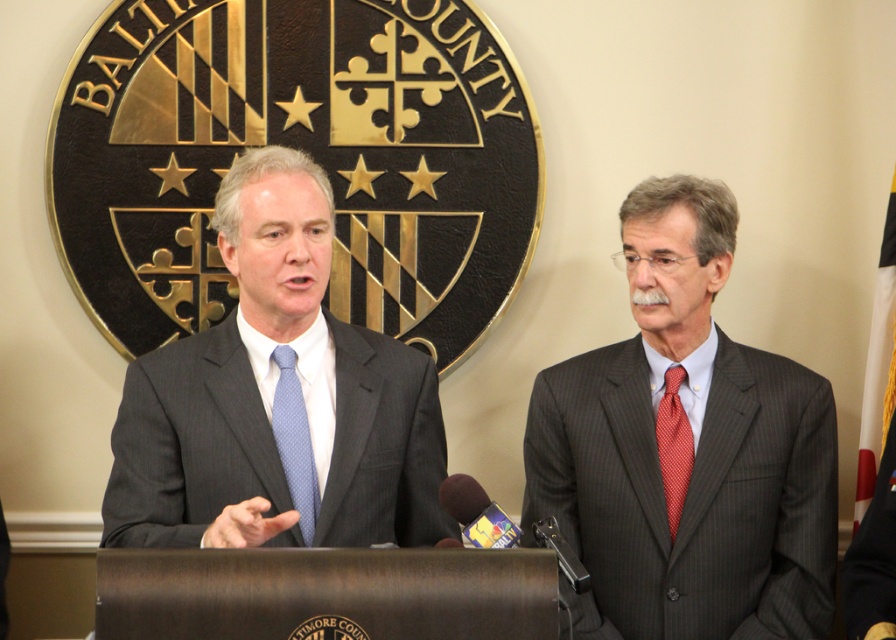
You are a photographer setting up for a group photo. You need to position two subjects wearing the dark gray pinstripe suit at right and the matte gray suit at center. Given the current distance between them, can you fit a 30 inch wide equipment cart between them without moving either subject?

The dark gray pinstripe suit at right is 29.54 inches away from the matte gray suit at center. Since the equipment cart is 30 inches wide, it cannot fit between them as the distance is slightly less than the cart width.

You are an event photographer at a press conference. You need to capture a photo of both the dark gray pinstripe suit at right and the matte gray suit at center. Based on their positions, which one should you focus on first to ensure both are in frame?

The dark gray pinstripe suit at right is below the matte gray suit at center, so you should focus on the matte gray suit at center first to ensure both are in frame.